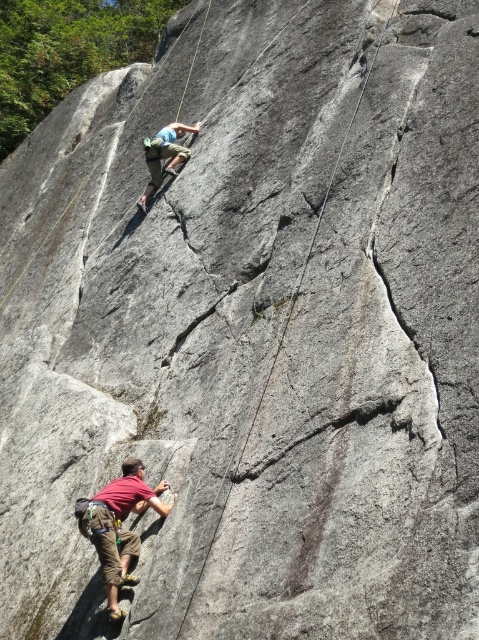
Is reddish-brown fabric climbing harness at lower left closer to camera compared to blue t-shirt at upper center?

Yes.

Who is taller, reddish-brown fabric climbing harness at lower left or blue t-shirt at upper center?

blue t-shirt at upper center

Between point (136, 504) and point (182, 134), which one is positioned in front?

Positioned in front is point (136, 504).

Where is `reddish-brown fabric climbing harness at lower left`? The image size is (479, 640). reddish-brown fabric climbing harness at lower left is located at coordinates (118, 525).

Is point (137, 480) less distant than point (255, 406)?

No, (137, 480) is further to viewer.

Is reddish-brown fabric climbing harness at lower left thinner than smooth gray rope at center?

Indeed, reddish-brown fabric climbing harness at lower left has a lesser width compared to smooth gray rope at center.

Is point (103, 547) closer to viewer compared to point (327, 198)?

Yes, point (103, 547) is in front of point (327, 198).

In order to click on reddish-brown fabric climbing harness at lower left in this screenshot , I will do `click(118, 525)`.

Looking at this image, who is positioned more to the right, smooth gray rope at center or blue t-shirt at upper center?

From the viewer's perspective, smooth gray rope at center appears more on the right side.

Can you confirm if smooth gray rope at center is positioned to the left of blue t-shirt at upper center?

In fact, smooth gray rope at center is to the right of blue t-shirt at upper center.

Identify the location of smooth gray rope at center. The width and height of the screenshot is (479, 640). (277, 332).